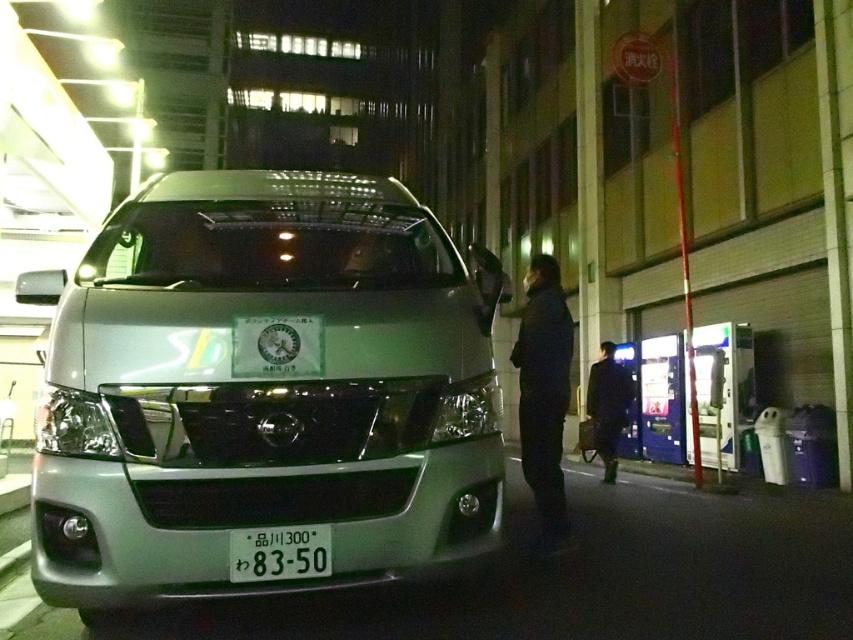
Does satin silver van at center appear over dark blue coat at center?

Correct, satin silver van at center is located above dark blue coat at center.

Measure the distance from satin silver van at center to dark blue coat at center.

They are 5.12 meters apart.

Who is more forward, (410, 273) or (630, 378)?

Positioned in front is point (410, 273).

You are a GUI agent. You are given a task and a screenshot of the screen. Output one action in this format:
    pyautogui.click(x=<x>, y=<y>)
    Task: Click on the satin silver van at center
    This screenshot has width=853, height=640.
    Given the screenshot: What is the action you would take?
    pyautogui.click(x=262, y=388)

Is satin silver van at center closer to the viewer compared to white plastic license plate at center?

Yes.

Based on the photo, who is more forward, (407, 540) or (291, 545)?

Point (291, 545) is in front.

The image size is (853, 640). Describe the element at coordinates (262, 388) in the screenshot. I see `satin silver van at center` at that location.

At what (x,y) coordinates should I click in order to perform the action: click on satin silver van at center. Please return your answer as a coordinate pair (x, y). Looking at the image, I should click on (262, 388).

Between point (556, 451) and point (245, 570), which one is positioned behind?

The point (556, 451) is behind.

Is the position of black matte jacket at center less distant than that of white plastic license plate at center?

No.

Is point (556, 522) behind point (308, 557)?

That is True.

This screenshot has height=640, width=853. Identify the location of black matte jacket at center. (544, 394).